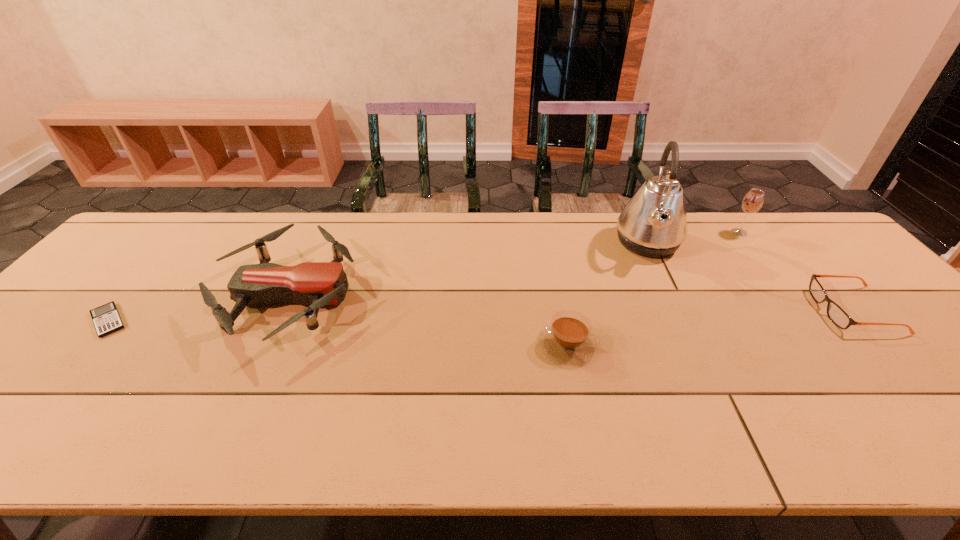
Find the location of a particular element. kettle located at the far edge is located at coordinates (653, 223).

Image resolution: width=960 pixels, height=540 pixels. I want to click on wineglass located at the far edge, so click(753, 201).

Identify the location of drone that is positioned at the far edge. (317, 284).

In order to click on object situated at the left edge in this screenshot , I will do `click(106, 319)`.

Where is `object that is at the right edge`? This screenshot has height=540, width=960. object that is at the right edge is located at coordinates (836, 314).

The image size is (960, 540). I want to click on vacant space at the far edge of the desktop, so click(x=437, y=213).

The image size is (960, 540). What are the coordinates of `blank space at the near edge` in the screenshot? It's located at (765, 426).

The image size is (960, 540). In order to click on vacant space at the left edge of the desktop in this screenshot , I will do `click(70, 334)`.

Find the location of a particular element. vacant space at the right edge is located at coordinates (940, 406).

Find the location of a particular element. free space at the far left corner is located at coordinates (154, 221).